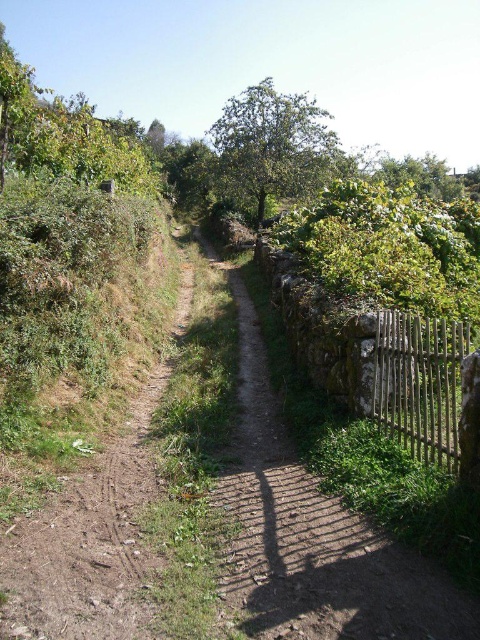
Question: Among these points, which one is farthest from the camera?

Choices:
 (A) (370, 589)
 (B) (304, 140)

Answer: (B)

Question: Which object is farther from the camera taking this photo?

Choices:
 (A) dirt path at center
 (B) green leafy tree at center
 (C) wooden fence at right

Answer: (B)

Question: Does dirt path at center appear under green leafy tree at center?

Choices:
 (A) no
 (B) yes

Answer: (B)

Question: Can you confirm if dirt path at center is positioned above wooden fence at right?

Choices:
 (A) no
 (B) yes

Answer: (A)

Question: Can you confirm if dirt path at center is positioned to the left of green leafy tree at center?

Choices:
 (A) no
 (B) yes

Answer: (B)

Question: Which object appears farthest from the camera in this image?

Choices:
 (A) dirt path at center
 (B) green leafy tree at center

Answer: (B)